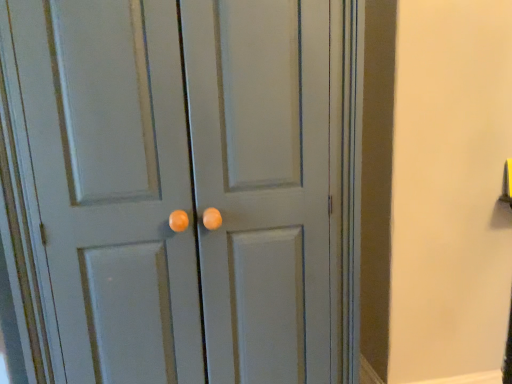
What do you see at coordinates (189, 186) in the screenshot?
I see `matte gray door at center` at bounding box center [189, 186].

What is the approximate width of matte gray door at center?

matte gray door at center is 27.54 inches in width.

Locate an element on the screen. The height and width of the screenshot is (384, 512). matte gray door at center is located at coordinates (189, 186).

Measure the distance between matte gray door at center and camera.

The distance of matte gray door at center from camera is 33.49 inches.

Where is `matte gray door at center`? This screenshot has height=384, width=512. matte gray door at center is located at coordinates (189, 186).